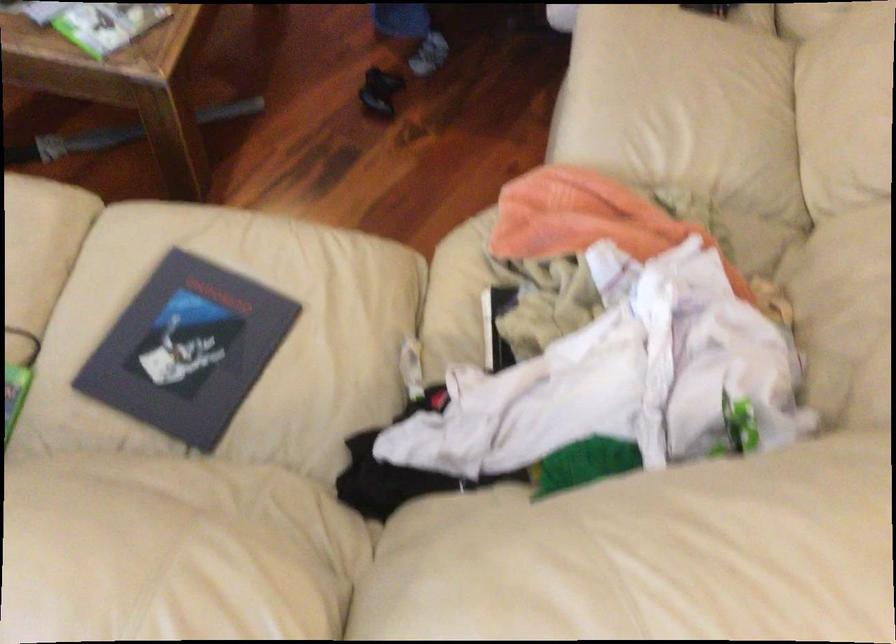
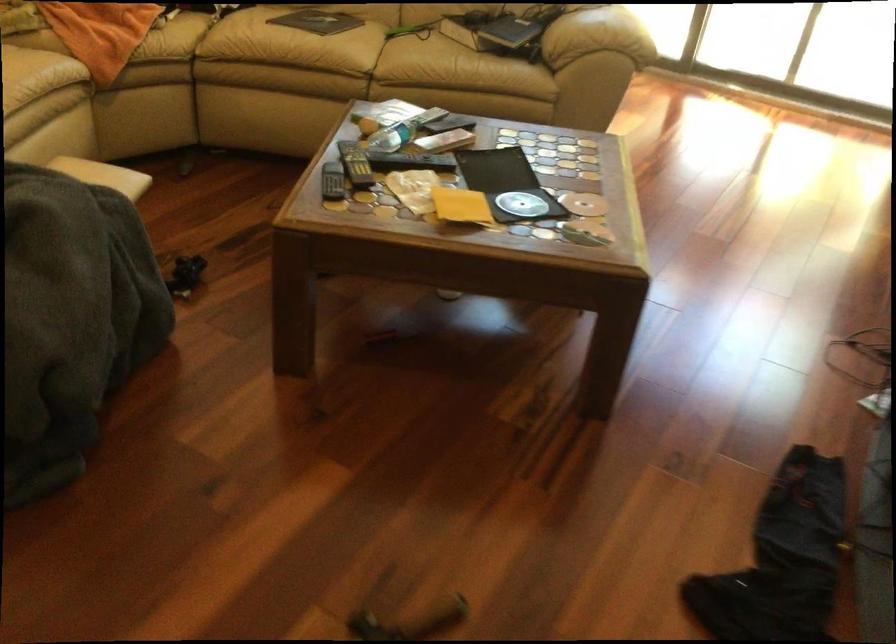
Find the pixel in the second image that matches [166,222] in the first image.

(334, 58)